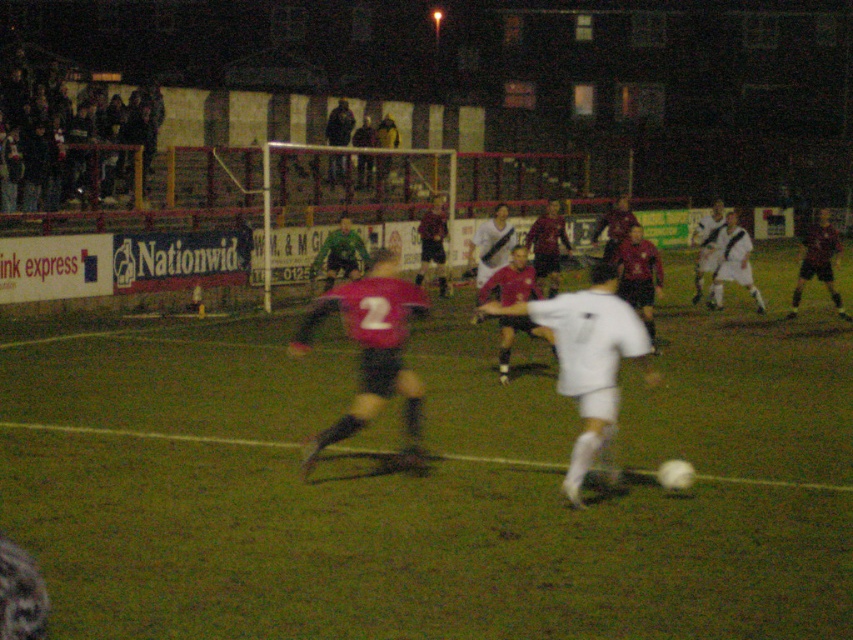
You are a referee watching the soccer match. You need to determine if the white matte soccer player at center is closer to the ball than the dark red jersey at center. Can you confirm this?

The white matte soccer player at center is in front of the dark red jersey at center, so yes, the white matte soccer player at center is closer to the ball than the dark red jersey at center.

You are a soccer player positioned at the edge of the field. You see the green grass football field at center and the dark red jersey at center. Which object is closer to the left side of the field?

The green grass football field at center is to the left of the dark red jersey at center, so the green grass football field at center is closer to the left side of the field.